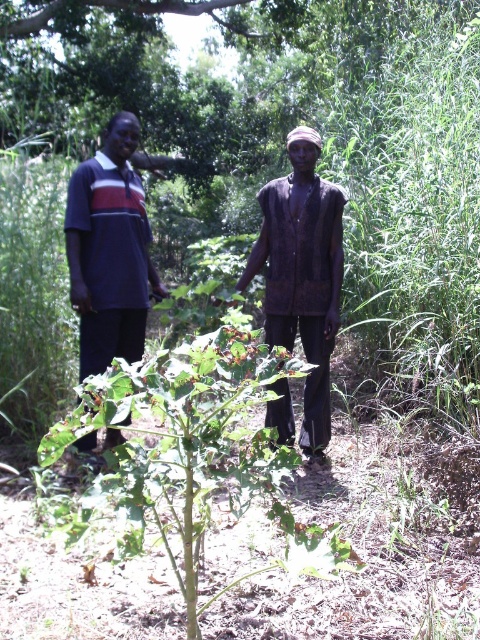
Can you confirm if dark brown fabric at center is smaller than dark blue jersey at left?

Actually, dark brown fabric at center might be larger than dark blue jersey at left.

Measure the distance between dark brown fabric at center and camera.

14.42 feet

Is point (284, 209) farther from camera compared to point (94, 188)?

Yes, it is behind point (94, 188).

At what (x,y) coordinates should I click in order to perform the action: click on dark brown fabric at center. Please return your answer as a coordinate pair (x, y). Looking at the image, I should click on (302, 273).

Which is behind, point (165, 417) or point (127, 336)?

The point (127, 336) is behind.

Where is `green leafy plant at center`? The width and height of the screenshot is (480, 640). green leafy plant at center is located at coordinates (x=189, y=456).

Locate an element on the screen. green leafy plant at center is located at coordinates (189, 456).

Does green leafy plant at center have a larger size compared to dark brown fabric at center?

Indeed, green leafy plant at center has a larger size compared to dark brown fabric at center.

Between point (163, 403) and point (307, 148), which one is positioned in front?

Point (163, 403)

The width and height of the screenshot is (480, 640). Find the location of `green leafy plant at center`. green leafy plant at center is located at coordinates (189, 456).